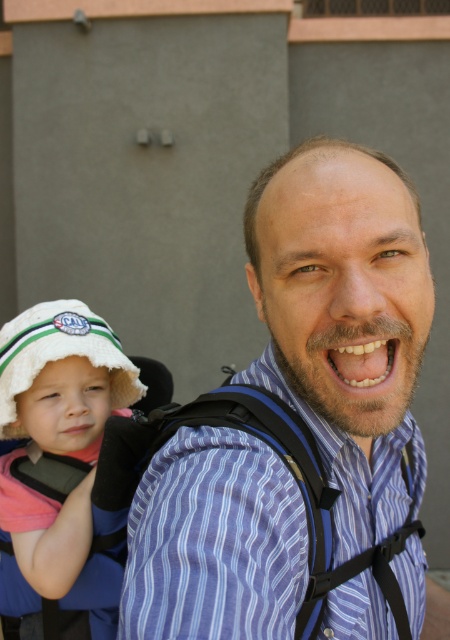
You are trying to decide which blue shirt to wear for a hiking trip. The blue striped shirt at center and the smooth blue shirt at center are both in your closet. Based on their sizes, which one would be more comfortable for carrying a backpack?

The blue striped shirt at center is larger in size than the smooth blue shirt at center, so it would be more comfortable for carrying a backpack as it provides more room and mobility.

You are a photographer trying to capture a photo of both the blue striped shirt at center and the smooth blue shirt at center. Since you want them in the same frame, which one should you position closer to the left side of the camera?

The blue striped shirt at center should be positioned closer to the left side of the camera because it is already to the left of the smooth blue shirt at center in the scene.